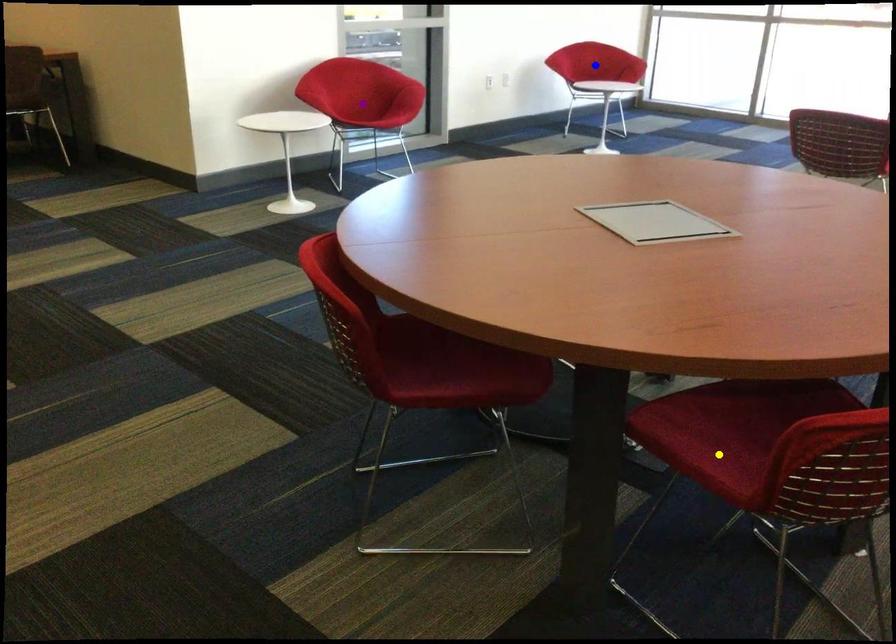
Order these from nearest to farthest:
purple point
blue point
yellow point

yellow point
purple point
blue point